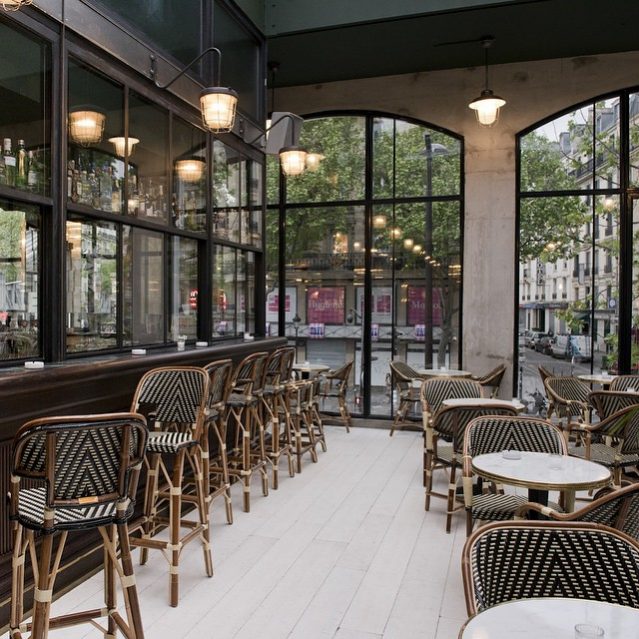
You are a GUI agent. You are given a task and a screenshot of the screen. Output one action in this format:
    pyautogui.click(x=<x>, y=<y>)
    Task: Click on the lights
    
    Given the screenshot: What is the action you would take?
    pyautogui.click(x=219, y=105), pyautogui.click(x=296, y=154), pyautogui.click(x=475, y=112), pyautogui.click(x=16, y=3)